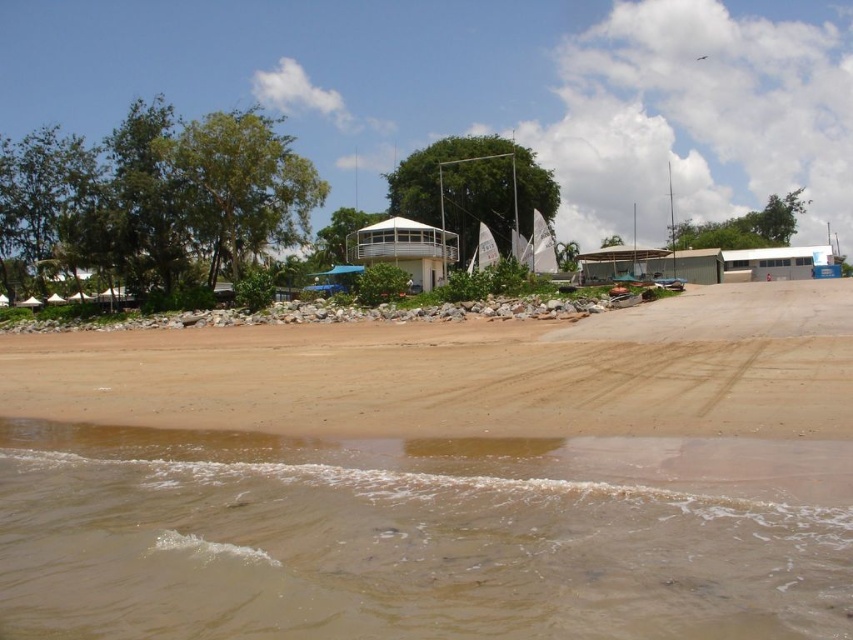
You are standing on the beach and see the brown sandy water at lower left and the brown sand at lower center. Which one is located to the left of the other?

The brown sandy water at lower left is to the left of the brown sand at lower center.

You are standing at the beach and want to locate two points marked in the image. The first point is at coordinates point (125, 444) and the second is at point (711, 412). Which point is closer to you?

Point (125, 444) is closer to you because it is further to the camera than point (711, 412).

You are standing on the beach and see the brown sandy water at lower left and the brown sand at lower center. Which one is closer to the ocean?

The brown sandy water at lower left is closer to the ocean because it is located below the brown sand at lower center, indicating it is nearer to the shoreline where the water meets the land.